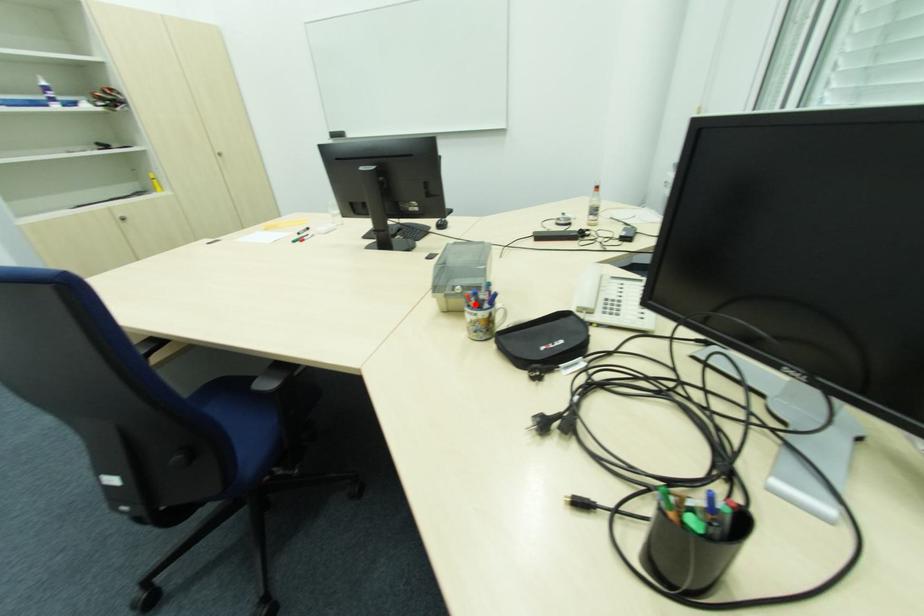
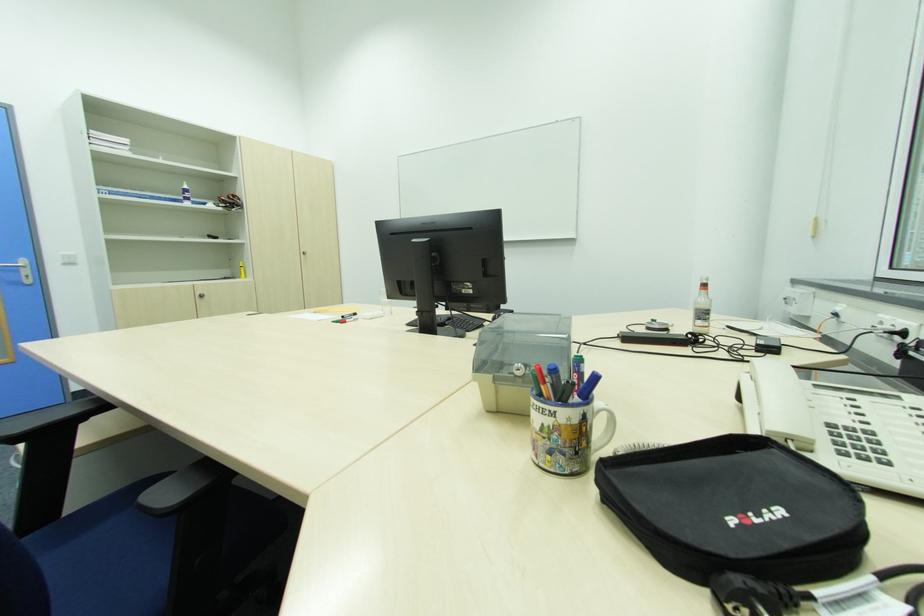
In the second image, find the point that corresponds to the highlighted location in the first image.

(550, 391)